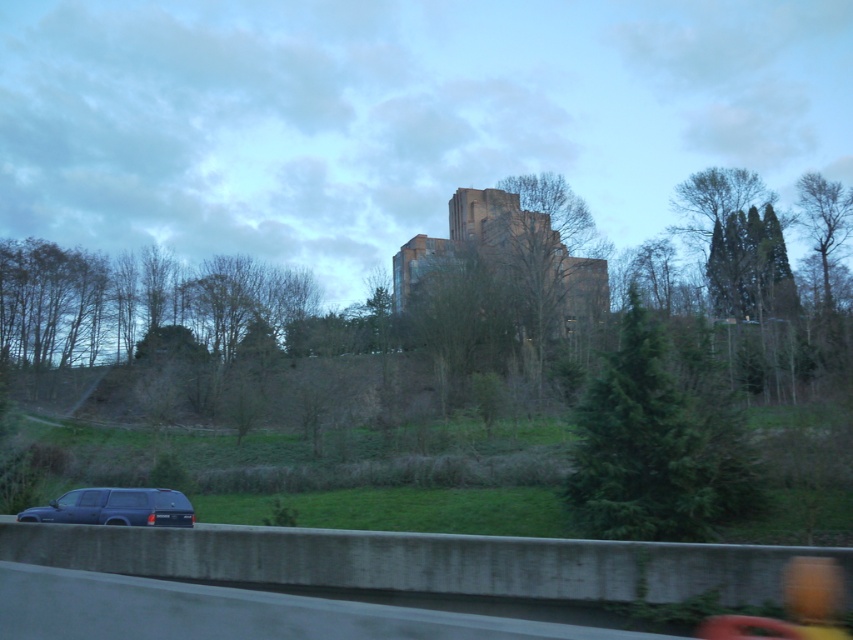
Does brown textured tree at center have a greater width compared to matte black car window at lower left?

Yes.

Does brown textured tree at center have a lesser width compared to matte black car window at lower left?

Incorrect, brown textured tree at center's width is not less than matte black car window at lower left's.

Find the location of `brown textured tree at center`. brown textured tree at center is located at coordinates (549, 273).

Locate an element on the screen. The height and width of the screenshot is (640, 853). brown textured tree at center is located at coordinates (549, 273).

Does green leafy tree at upper right have a greater height compared to transparent glass car window at lower left?

Yes, green leafy tree at upper right is taller than transparent glass car window at lower left.

Image resolution: width=853 pixels, height=640 pixels. In order to click on green leafy tree at upper right in this screenshot , I will do `click(735, 237)`.

Image resolution: width=853 pixels, height=640 pixels. In order to click on green leafy tree at upper right in this screenshot , I will do `click(735, 237)`.

Does brown textured tree at center have a larger size compared to transparent glass car window at lower left?

Indeed, brown textured tree at center has a larger size compared to transparent glass car window at lower left.

Between brown textured tree at center and transparent glass car window at lower left, which one appears on the left side from the viewer's perspective?

From the viewer's perspective, transparent glass car window at lower left appears more on the left side.

Measure the distance between point (590,234) and camera.

They are 84.14 meters apart.

The image size is (853, 640). I want to click on brown textured tree at center, so click(549, 273).